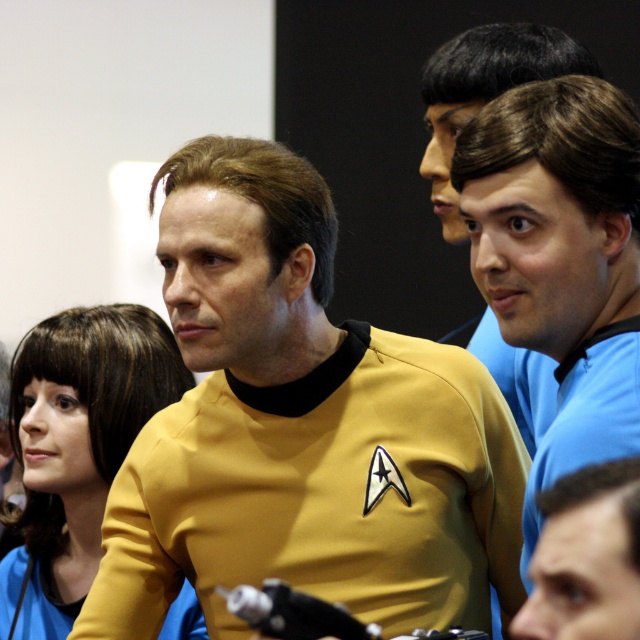
You are organizing a Star Trek costume party and need to arrange the costumes by size. Given the yellow matte uniform at center and the matte blue shirt at lower right, which costume should you place first if you are arranging them from largest to smallest?

The yellow matte uniform at center is bigger than the matte blue shirt at lower right, so you should place the yellow matte uniform at center first when arranging from largest to smallest.

Based on the coordinates provided, is the point at (301, 428) located on the yellow matte uniform at center?

Yes, the point at (301, 428) is located on the yellow matte uniform at center as stated in the description.